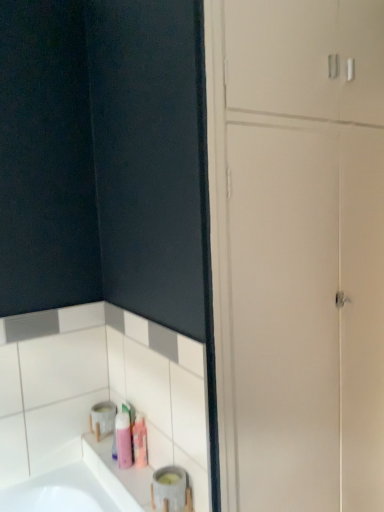
Question: Should I look upward or downward to see pink matte toiletry at lower center, positioned as the first toiletry in right-to-left order?

Choices:
 (A) down
 (B) up

Answer: (A)

Question: Is pink matte toiletry at lower center, the second toiletry from the left, taller than matte gray container at lower left?

Choices:
 (A) yes
 (B) no

Answer: (A)

Question: Is pink matte toiletry at lower center, positioned as the first toiletry in right-to-left order, outside matte gray container at lower left?

Choices:
 (A) no
 (B) yes

Answer: (B)

Question: From a real-world perspective, is pink matte toiletry at lower center, positioned as the first toiletry in right-to-left order, positioned under matte gray container at lower left based on gravity?

Choices:
 (A) no
 (B) yes

Answer: (A)

Question: From the image's perspective, is pink matte toiletry at lower center, positioned as the first toiletry in right-to-left order, located above matte gray container at lower left?

Choices:
 (A) no
 (B) yes

Answer: (B)

Question: Is pink matte toiletry at lower center, positioned as the first toiletry in right-to-left order, far from matte gray container at lower left?

Choices:
 (A) yes
 (B) no

Answer: (B)

Question: Does pink matte toiletry at lower center, the second toiletry from the left, contain matte gray container at lower left?

Choices:
 (A) no
 (B) yes

Answer: (A)

Question: Considering the relative sizes of white glossy dresser at lower left and pink matte toiletry at lower center, positioned as the first toiletry in right-to-left order, in the image provided, is white glossy dresser at lower left taller than pink matte toiletry at lower center, positioned as the first toiletry in right-to-left order,?

Choices:
 (A) no
 (B) yes

Answer: (B)

Question: From the image's perspective, would you say white glossy dresser at lower left is positioned over pink matte toiletry at lower center, the second toiletry from the left?

Choices:
 (A) yes
 (B) no

Answer: (A)

Question: Considering the relative positions of white glossy dresser at lower left and pink matte toiletry at lower center, the second toiletry from the left, in the image provided, is white glossy dresser at lower left to the right of pink matte toiletry at lower center, the second toiletry from the left, from the viewer's perspective?

Choices:
 (A) yes
 (B) no

Answer: (A)

Question: Is white glossy dresser at lower left shorter than pink matte toiletry at lower center, positioned as the first toiletry in right-to-left order?

Choices:
 (A) yes
 (B) no

Answer: (B)

Question: Is pink matte toiletry at lower center, the second toiletry from the left, located within white glossy dresser at lower left?

Choices:
 (A) no
 (B) yes

Answer: (A)

Question: Are white glossy dresser at lower left and pink matte toiletry at lower center, the second toiletry from the left, beside each other?

Choices:
 (A) yes
 (B) no

Answer: (B)

Question: Is matte gray container at lower left not within pink matte toiletry at lower center, the second toiletry from the left?

Choices:
 (A) yes
 (B) no

Answer: (A)